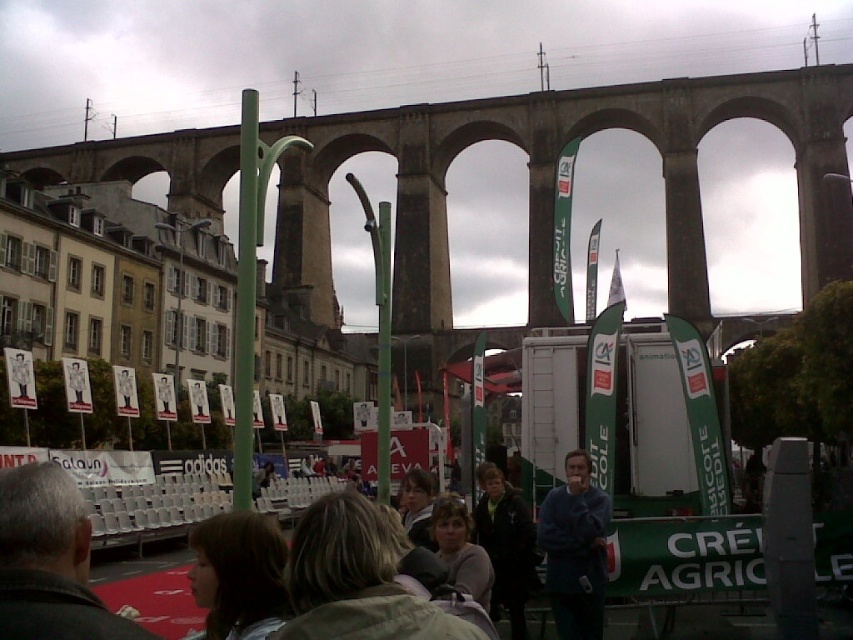
Question: Which is farther from the dark brown leather jacket at lower left?

Choices:
 (A) green metallic pole at center
 (B) dark green jacket at center
 (C) blonde hair at center
 (D) matte gray jacket at center

Answer: (A)

Question: Estimate the real-world distances between objects in this image. Which object is farther from the green metallic pole at center?

Choices:
 (A) blue fleece at center
 (B) dark brown leather jacket at lower left
 (C) dark gray fabric crowd at center

Answer: (B)

Question: Does dark brown leather jacket at lower left have a larger size compared to matte gray jacket at center?

Choices:
 (A) yes
 (B) no

Answer: (A)

Question: Considering the relative positions of blue fleece at center and green metallic pole at center in the image provided, where is blue fleece at center located with respect to green metallic pole at center?

Choices:
 (A) below
 (B) above

Answer: (A)

Question: Which object appears farthest from the camera in this image?

Choices:
 (A) blonde hair at center
 (B) green matte pole at center
 (C) dark gray fabric crowd at center
 (D) green metallic pole at center

Answer: (D)

Question: Is blonde hair at lower center thinner than dark green jacket at center?

Choices:
 (A) yes
 (B) no

Answer: (B)